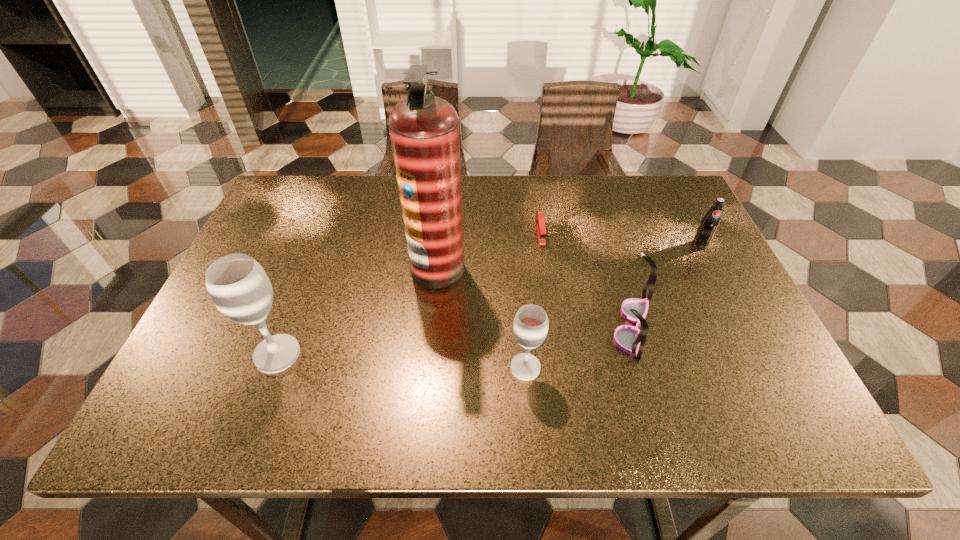
Identify the location of vacant space that satisfies the following two spatial constraints: 1. at the nozzle of the fire extinguisher; 2. on the back side of the spectacles. (432, 326).

In order to click on vacant region that satisfies the following two spatial constraints: 1. on the front label of the pop; 2. at the nozzle of the tallest object in this screenshot , I will do `click(712, 267)`.

Find the location of `free point that satisfies the following two spatial constraints: 1. at the nozzle of the second object from right to left; 2. on the left side of the fifth object from right to left`. free point that satisfies the following two spatial constraints: 1. at the nozzle of the second object from right to left; 2. on the left side of the fifth object from right to left is located at coordinates (432, 326).